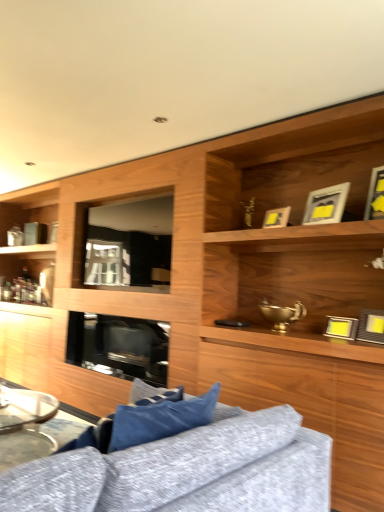
Question: Can you confirm if metallic silver tray at lower left is bigger than transparent glass window at center?

Choices:
 (A) no
 (B) yes

Answer: (B)

Question: From a real-world perspective, is metallic silver tray at lower left beneath transparent glass window at center?

Choices:
 (A) no
 (B) yes

Answer: (B)

Question: From a real-world perspective, is metallic silver tray at lower left physically above transparent glass window at center?

Choices:
 (A) yes
 (B) no

Answer: (B)

Question: Does metallic silver tray at lower left have a greater height compared to transparent glass window at center?

Choices:
 (A) no
 (B) yes

Answer: (A)

Question: Is transparent glass window at center completely or partially inside metallic silver tray at lower left?

Choices:
 (A) yes
 (B) no

Answer: (B)

Question: Does metallic silver tray at lower left lie in front of transparent glass window at center?

Choices:
 (A) yes
 (B) no

Answer: (A)

Question: Is matte gold picture frame at upper center, acting as the 3th picture frame starting from the top, facing away from metallic silver picture frame at right, marked as the fifth picture frame in a top-to-bottom arrangement?

Choices:
 (A) yes
 (B) no

Answer: (B)

Question: Can you confirm if matte gold picture frame at upper center, which ranks as the 3th picture frame in bottom-to-top order, is taller than metallic silver picture frame at right, marked as the fifth picture frame in a top-to-bottom arrangement?

Choices:
 (A) yes
 (B) no

Answer: (A)

Question: Is there a large distance between matte gold picture frame at upper center, which ranks as the 3th picture frame in bottom-to-top order, and metallic silver picture frame at right, which is the first picture frame from bottom to top?

Choices:
 (A) yes
 (B) no

Answer: (B)

Question: From a real-world perspective, is matte gold picture frame at upper center, which ranks as the 3th picture frame in bottom-to-top order, below metallic silver picture frame at right, marked as the fifth picture frame in a top-to-bottom arrangement?

Choices:
 (A) yes
 (B) no

Answer: (B)

Question: Does matte gold picture frame at upper center, which ranks as the 3th picture frame in bottom-to-top order, turn towards metallic silver picture frame at right, which is the first picture frame from bottom to top?

Choices:
 (A) no
 (B) yes

Answer: (A)

Question: Is matte gold picture frame at upper center, which ranks as the 3th picture frame in bottom-to-top order, smaller than metallic silver picture frame at right, which is the first picture frame from bottom to top?

Choices:
 (A) yes
 (B) no

Answer: (A)

Question: Is matte gold picture frame at upper right, which is counted as the 2th picture frame, starting from the top, at the right side of transparent glass window at center?

Choices:
 (A) no
 (B) yes

Answer: (B)